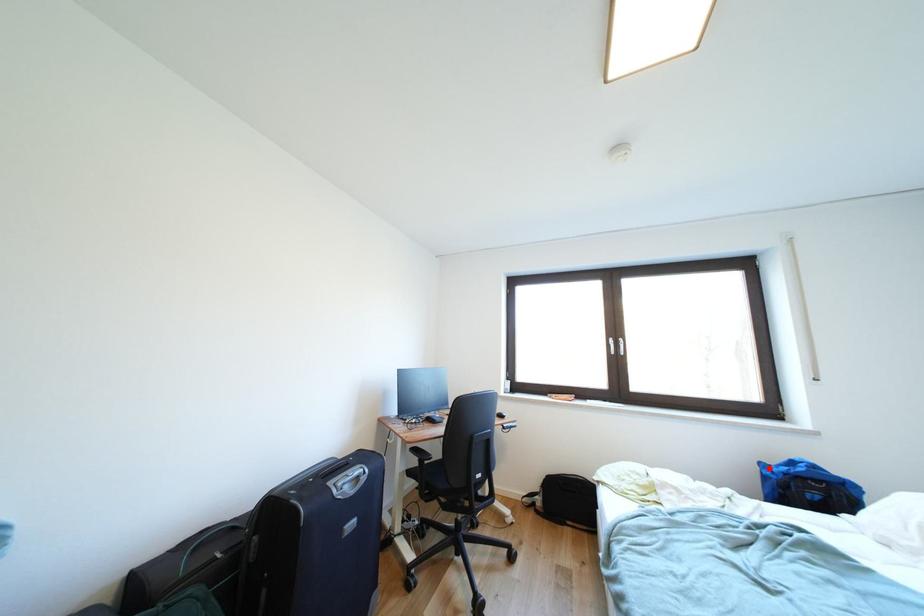
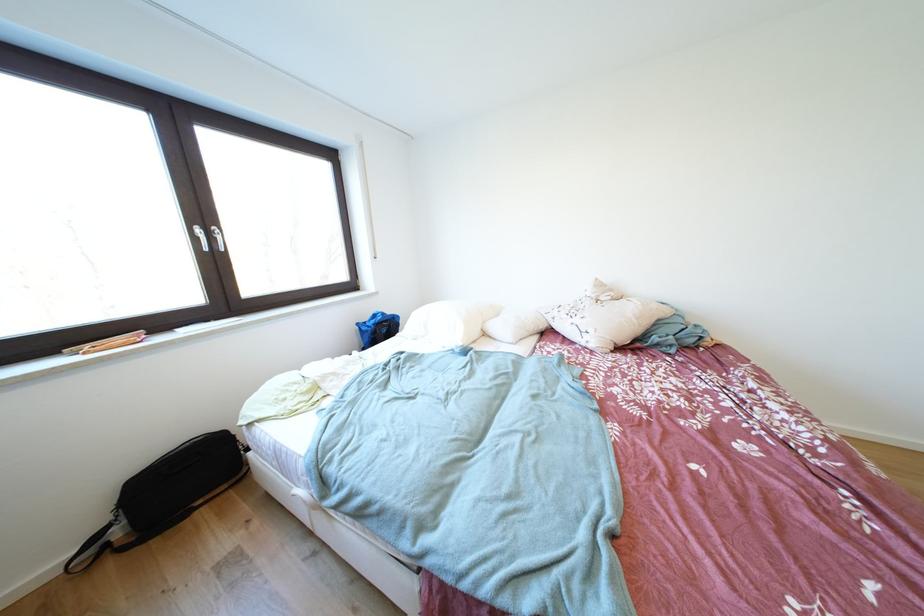
Locate, in the second image, the point that corresponds to the highlighted location in the first image.

(367, 329)